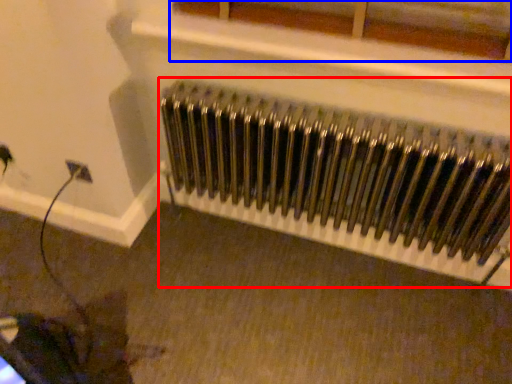
Question: Which point is closer to the camera, radiator (highlighted by a red box) or window (highlighted by a blue box)?

Choices:
 (A) radiator
 (B) window

Answer: (B)